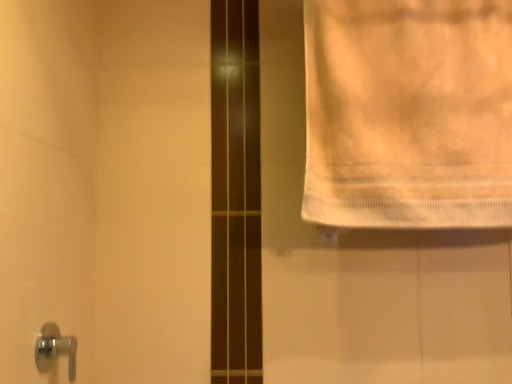
Question: From a real-world perspective, relative to white cotton towel at upper right, is chrome metallic door handle at lower left vertically above or below?

Choices:
 (A) below
 (B) above

Answer: (A)

Question: Is point (48, 322) positioned closer to the camera than point (372, 168)?

Choices:
 (A) closer
 (B) farther

Answer: (A)

Question: From the image's perspective, is chrome metallic door handle at lower left positioned above or below white cotton towel at upper right?

Choices:
 (A) above
 (B) below

Answer: (B)

Question: From the image's perspective, relative to chrome metallic door handle at lower left, is white cotton towel at upper right above or below?

Choices:
 (A) above
 (B) below

Answer: (A)

Question: In terms of height, does white cotton towel at upper right look taller or shorter compared to chrome metallic door handle at lower left?

Choices:
 (A) tall
 (B) short

Answer: (A)

Question: Would you say white cotton towel at upper right is inside or outside chrome metallic door handle at lower left?

Choices:
 (A) outside
 (B) inside

Answer: (A)

Question: Is white cotton towel at upper right in front of or behind chrome metallic door handle at lower left in the image?

Choices:
 (A) front
 (B) behind

Answer: (B)